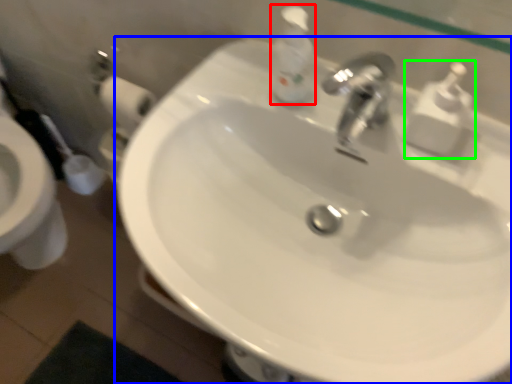
Question: Which is farther away from soap dispenser (highlighted by a red box)? sink (highlighted by a blue box) or soap dispenser (highlighted by a green box)?

Choices:
 (A) sink
 (B) soap dispenser

Answer: (A)